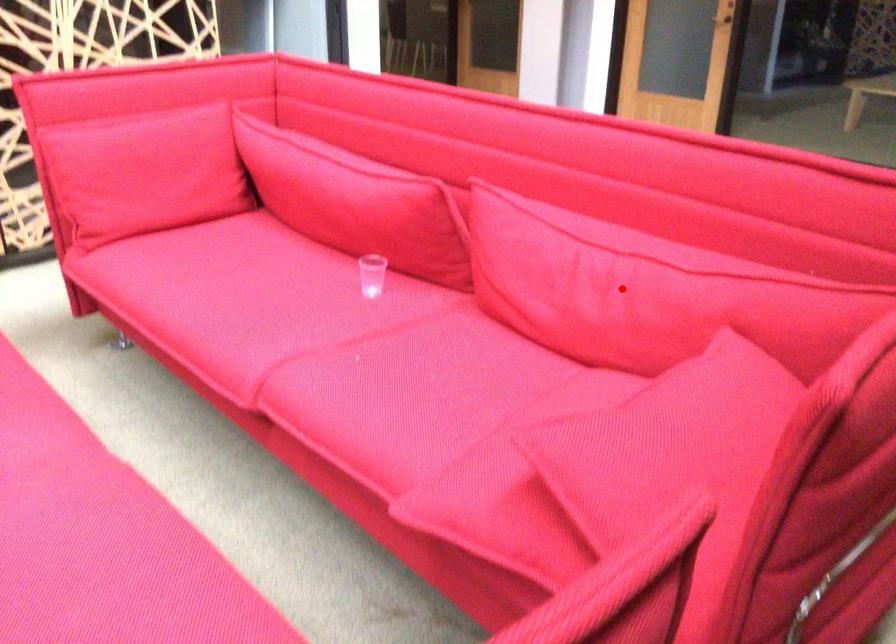
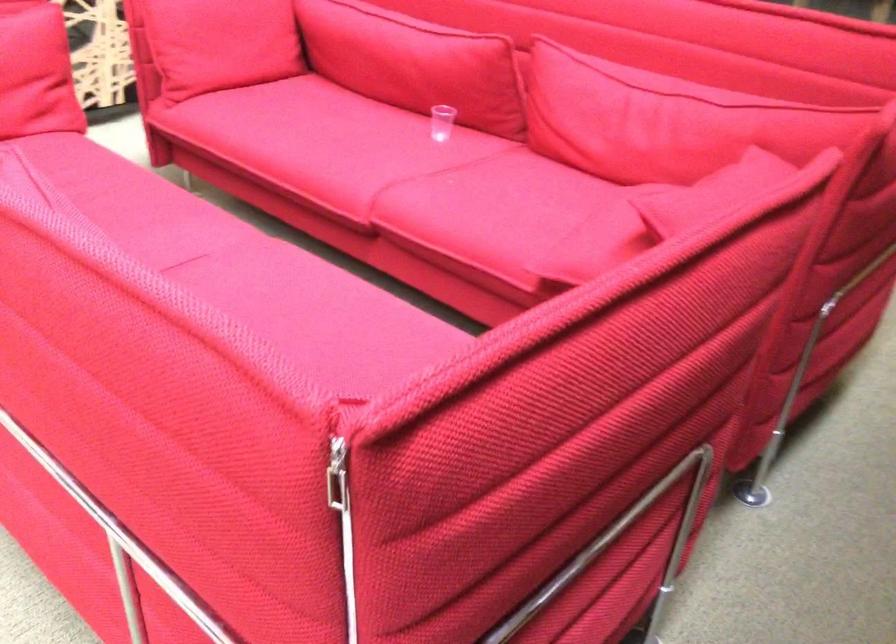
Locate, in the second image, the point that corresponds to the highlighted location in the first image.

(664, 120)